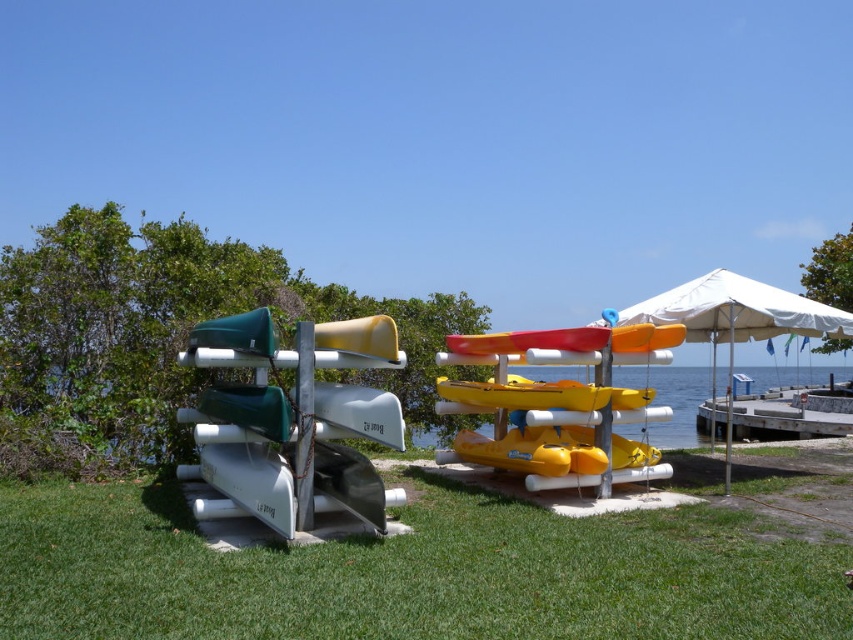
Question: Which of these objects is positioned closest to the green grass at center?

Choices:
 (A) yellow matte kayak at center
 (B) green matte kayak at left
 (C) concrete dock at lower right
 (D) white fabric umbrella at center

Answer: (B)

Question: Is yellow matte kayak at center to the right of white fabric umbrella at center from the viewer's perspective?

Choices:
 (A) yes
 (B) no

Answer: (B)

Question: Is yellow matte kayak at center below concrete dock at lower right?

Choices:
 (A) yes
 (B) no

Answer: (B)

Question: Can you confirm if green grass at center is positioned to the right of concrete dock at lower right?

Choices:
 (A) no
 (B) yes

Answer: (A)

Question: Which of the following is the farthest from the observer?

Choices:
 (A) (573, 636)
 (B) (671, 298)
 (C) (778, 424)
 (D) (368, 416)

Answer: (C)

Question: Which of the following is the closest to the observer?

Choices:
 (A) white fabric umbrella at center
 (B) green matte kayak at left
 (C) concrete dock at lower right
 (D) green grass at center

Answer: (B)